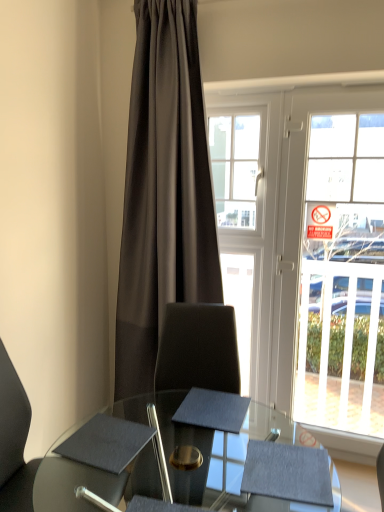
Where is `matte black chair at lower left`? This screenshot has width=384, height=512. matte black chair at lower left is located at coordinates (14, 441).

Find the location of a particular element. This screenshot has width=384, height=512. matte black notepad at center, placed as the 2th notepad when sorted from left to right is located at coordinates (213, 410).

Describe the element at coordinates (198, 349) in the screenshot. This screenshot has width=384, height=512. I see `matte black swivel chair at center` at that location.

Describe the element at coordinates (106, 443) in the screenshot. I see `matte black notepad at lower left, positioned as the first notepad in left-to-right order` at that location.

What do you see at coordinates (91, 480) in the screenshot?
I see `matte black glass table at center` at bounding box center [91, 480].

Where is `matte black chair at lower left`? The width and height of the screenshot is (384, 512). matte black chair at lower left is located at coordinates (14, 441).

Is matte black notepad at center, marked as the first notepad in a right-to-left arrangement, in contact with matte black glass table at center?

No, matte black notepad at center, marked as the first notepad in a right-to-left arrangement, is not touching matte black glass table at center.

From the image's perspective, is matte black notepad at center, marked as the first notepad in a right-to-left arrangement, positioned above or below matte black glass table at center?

Clearly, from the image's perspective, matte black notepad at center, marked as the first notepad in a right-to-left arrangement, is above matte black glass table at center.

From a real-world perspective, between matte black glass table at center and matte black swivel chair at center, who is vertically lower?

matte black glass table at center, from a real-world perspective.

How different are the orientations of matte black glass table at center and matte black swivel chair at center in degrees?

There is a 84.4-degree angle between the facing directions of matte black glass table at center and matte black swivel chair at center.

Identify the location of desk below the matte black swivel chair at center (from a real-world perspective). (91, 480).

Considering the positions of objects matte black glass table at center and matte black swivel chair at center in the image provided, who is more to the right, matte black glass table at center or matte black swivel chair at center?

matte black swivel chair at center is more to the right.

How many degrees apart are the facing directions of clear glass bay window at center and matte black glass table at center?

94.8 degrees separate the facing orientations of clear glass bay window at center and matte black glass table at center.

Which object is positioned more to the left, clear glass bay window at center or matte black glass table at center?

Positioned to the left is matte black glass table at center.

Does clear glass bay window at center have a lesser height compared to matte black glass table at center?

In fact, clear glass bay window at center may be taller than matte black glass table at center.

Between dark gray fabric curtain at center and matte black glass table at center, which one is positioned in front?

matte black glass table at center is more forward.

Is point (138, 172) farther from camera compared to point (139, 468)?

Yes.

How different are the orientations of dark gray fabric curtain at center and matte black glass table at center in degrees?

They differ by 94.8 degrees in their facing directions.

Between dark gray fabric curtain at center and matte black glass table at center, which one has more height?

dark gray fabric curtain at center.

From the picture: In terms of height, does matte black chair at lower left look taller or shorter compared to clear glass bay window at center?

Considering their sizes, matte black chair at lower left has more height than clear glass bay window at center.

Which is more to the right, matte black chair at lower left or clear glass bay window at center?

clear glass bay window at center.

Can you see matte black chair at lower left touching clear glass bay window at center?

matte black chair at lower left and clear glass bay window at center are clearly separated.

Relative to clear glass bay window at center, is matte black chair at lower left in front or behind?

Clearly, matte black chair at lower left is in front of clear glass bay window at center.

Is matte black swivel chair at center facing towards clear glass bay window at center?

No, matte black swivel chair at center is not facing towards clear glass bay window at center.

Is matte black swivel chair at center to the left or to the right of clear glass bay window at center in the image?

matte black swivel chair at center is to the left of clear glass bay window at center.

Is matte black swivel chair at center wider or thinner than clear glass bay window at center?

Result: Considering their sizes, matte black swivel chair at center looks broader than clear glass bay window at center.

In the image, is matte black swivel chair at center positioned in front of or behind clear glass bay window at center?

Visually, matte black swivel chair at center is located in front of clear glass bay window at center.

Looking at this image, is clear glass bay window at center not close to matte black chair at lower left?

Indeed, clear glass bay window at center is not near matte black chair at lower left.

Looking at their sizes, would you say clear glass bay window at center is wider or thinner than matte black chair at lower left?

Considering their sizes, clear glass bay window at center looks slimmer than matte black chair at lower left.

Based on the photo, measure the distance from clear glass bay window at center to matte black chair at lower left.

clear glass bay window at center is 5.21 feet from matte black chair at lower left.

Which object is positioned more to the left, clear glass bay window at center or matte black chair at lower left?

From the viewer's perspective, matte black chair at lower left appears more on the left side.

From the image's perspective, which notepad is the 2nd one above the matte black glass table at center? Please provide its 2D coordinates.

[(213, 410)]

The height and width of the screenshot is (512, 384). I want to click on swivel chair above the matte black glass table at center (from a real-world perspective), so click(198, 349).

Considering their positions, is white glass door at right positioned further to matte black chair at lower left than matte black glass table at center?

white glass door at right lies further to matte black chair at lower left than the other object.

Looking at this image, looking at the image, which one is located further to white glass door at right, matte black swivel chair at center or matte black chair at lower left?

Among the two, matte black chair at lower left is located further to white glass door at right.

Looking at the image, which one is located further to matte black chair at lower left, dark gray fabric curtain at center or matte black notepad at center, marked as the first notepad in a right-to-left arrangement?

dark gray fabric curtain at center.

When comparing their distances from matte black swivel chair at center, does matte black glass table at center or white glass door at right seem closer?

Among the two, matte black glass table at center is located nearer to matte black swivel chair at center.

Based on the photo, considering their positions, is matte black notepad at lower left, the 2th notepad in the right-to-left sequence, positioned closer to white glass door at right than matte black glass table at center?

matte black glass table at center.

From the image, which object appears to be nearer to matte black swivel chair at center, matte black notepad at center, placed as the 2th notepad when sorted from left to right, or dark gray fabric curtain at center?

matte black notepad at center, placed as the 2th notepad when sorted from left to right, is positioned closer to the anchor matte black swivel chair at center.

Based on their spatial positions, is matte black glass table at center or matte black notepad at center, marked as the first notepad in a right-to-left arrangement, closer to clear glass bay window at center?

Among the two, matte black notepad at center, marked as the first notepad in a right-to-left arrangement, is located nearer to clear glass bay window at center.

From the image, which object appears to be nearer to white glass door at right, matte black chair at lower left or matte black notepad at center, placed as the 2th notepad when sorted from left to right?

Based on the image, matte black notepad at center, placed as the 2th notepad when sorted from left to right, appears to be nearer to white glass door at right.

Identify the location of swivel chair between matte black notepad at lower left, positioned as the first notepad in left-to-right order, and white glass door at right from left to right. This screenshot has width=384, height=512. (198, 349).

What are the coordinates of `swivel chair between matte black glass table at center and matte black notepad at center, placed as the 2th notepad when sorted from left to right, from front to back` in the screenshot? It's located at (198, 349).

You are a GUI agent. You are given a task and a screenshot of the screen. Output one action in this format:
    pyautogui.click(x=<x>, y=<y>)
    Task: Click on the notepad situated between matte black chair at lower left and matte black notepad at center, placed as the 2th notepad when sorted from left to right, from left to right
    
    Given the screenshot: What is the action you would take?
    pyautogui.click(x=106, y=443)

I want to click on bay window situated between dark gray fabric curtain at center and white glass door at right from left to right, so click(x=235, y=167).